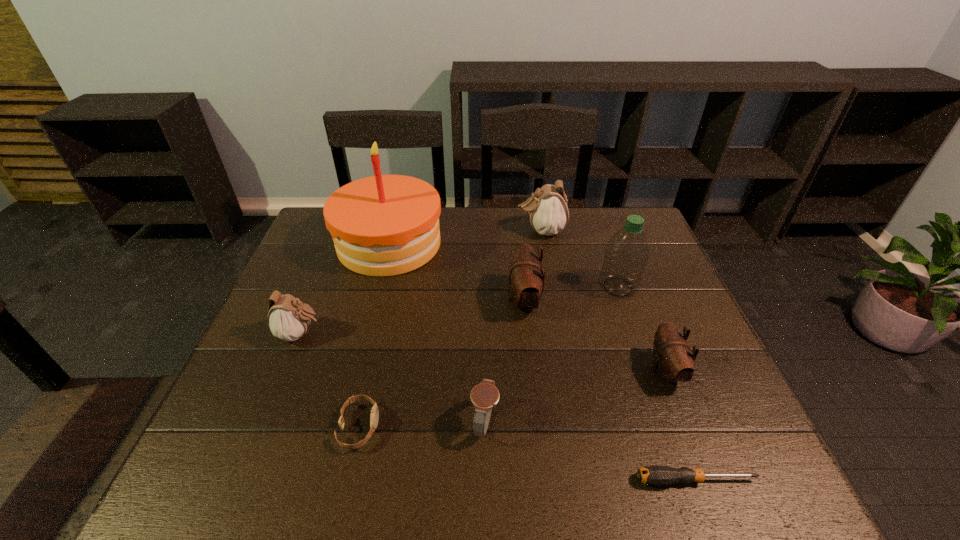
At what (x,y) coordinates should I click in order to perform the action: click on birthday cake. Please return your answer as a coordinate pair (x, y). This screenshot has height=540, width=960. Looking at the image, I should click on 384,225.

Identify the location of orange birthday cake. This screenshot has width=960, height=540. (384, 225).

The height and width of the screenshot is (540, 960). In order to click on the eighth shortest object in this screenshot , I will do `click(626, 254)`.

Identify the location of water bottle. (626, 254).

You are a GUI agent. You are given a task and a screenshot of the screen. Output one action in this format:
    pyautogui.click(x=<x>, y=<y>)
    Task: Click on the farthest pouch
    
    Given the screenshot: What is the action you would take?
    pyautogui.click(x=548, y=210)

You are a GUI agent. You are given a task and a screenshot of the screen. Output one action in this format:
    pyautogui.click(x=<x>, y=<y>)
    Task: Click on the bigger white pouch
    The height and width of the screenshot is (540, 960).
    Given the screenshot: What is the action you would take?
    pyautogui.click(x=548, y=210)

The image size is (960, 540). What are the coordinates of `the farther brown pouch` in the screenshot? It's located at (526, 279).

Identify the location of the left brown pouch. Image resolution: width=960 pixels, height=540 pixels. (526, 279).

Identify the location of the leftmost pouch. (288, 318).

Where is `the left white pouch`? This screenshot has height=540, width=960. the left white pouch is located at coordinates (288, 318).